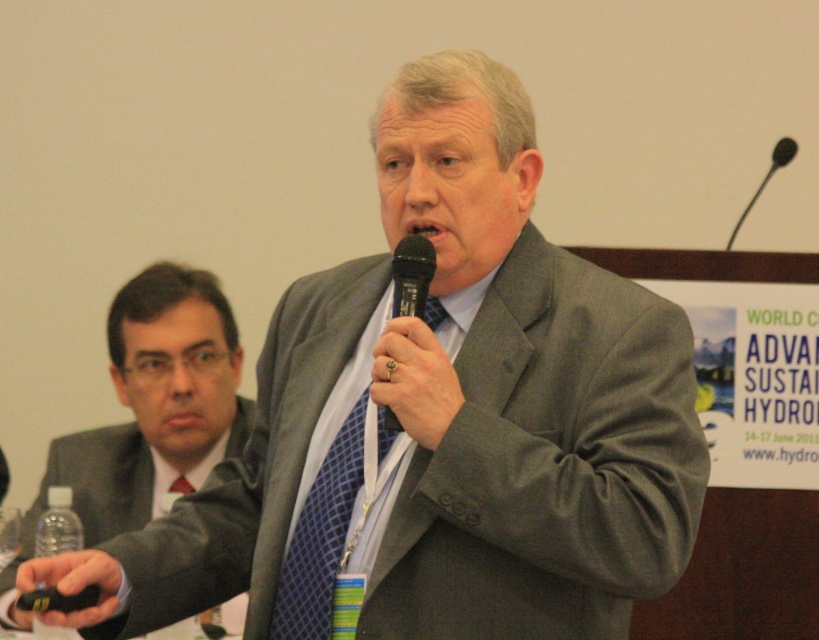
You are a photographer standing at the camera position. You want to capture a closeup shot of the gold ring at center without moving the camera. Is it possible to zoom in enough to make the ring fill the frame?

The gold ring at center is 1.60 meters away from the camera. Depending on the zoom capabilities of the camera, it may be possible to zoom in sufficiently to fill the frame with the ring at that distance. However, this depends on the specific lens and camera model available.

You are organizing a conference and need to locate the remote control for the presentation slides. The speaker is holding an object in their hand. Where is the black plastic remote at lower left in the image?

The black plastic remote at lower left is located at point coordinates of (x=73, y=582).